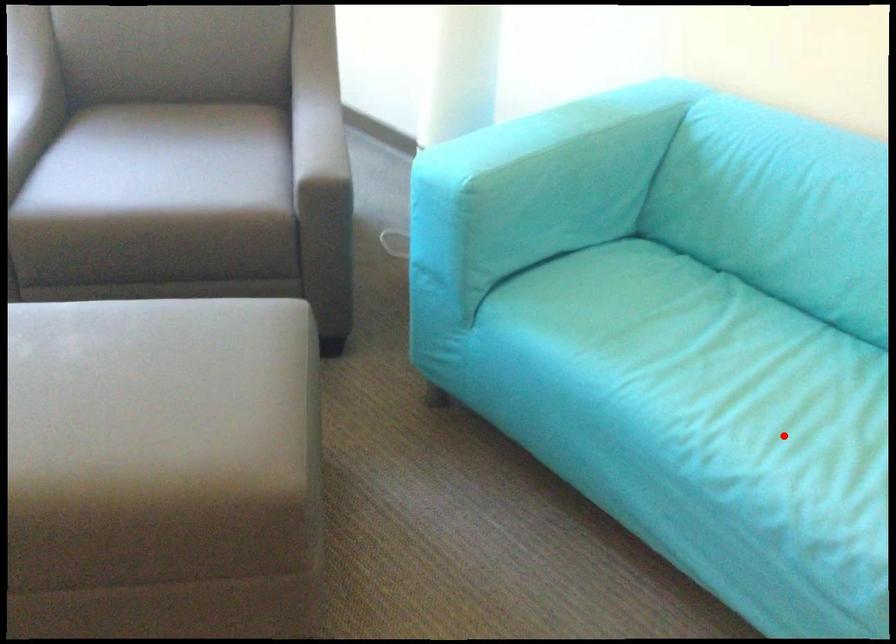
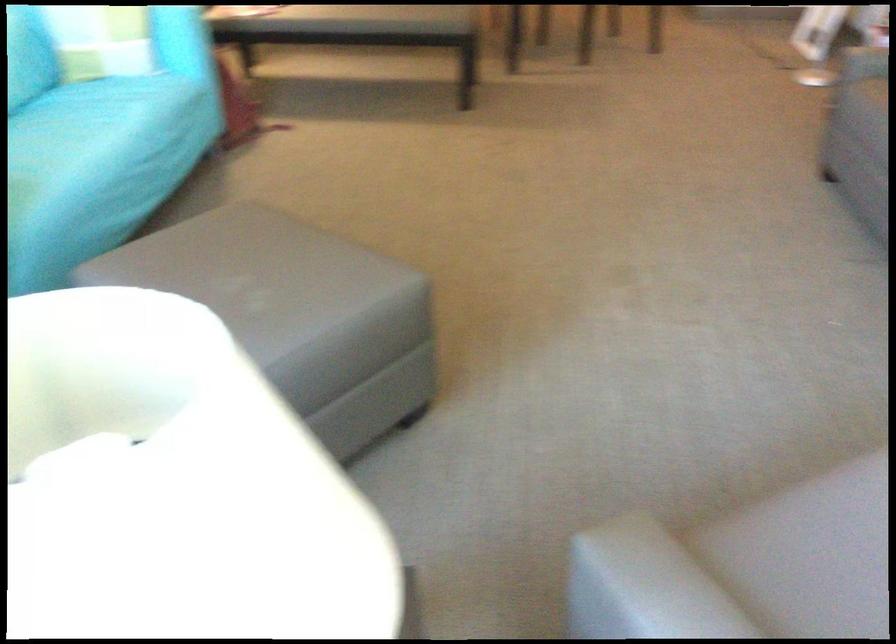
Question: A red point is marked in image1. In image2, is the corresponding 3D point closer to the camera or farther? Reply with the corresponding letter.

Choices:
 (A) The corresponding 3D point is closer.
 (B) The corresponding 3D point is farther.

Answer: (B)